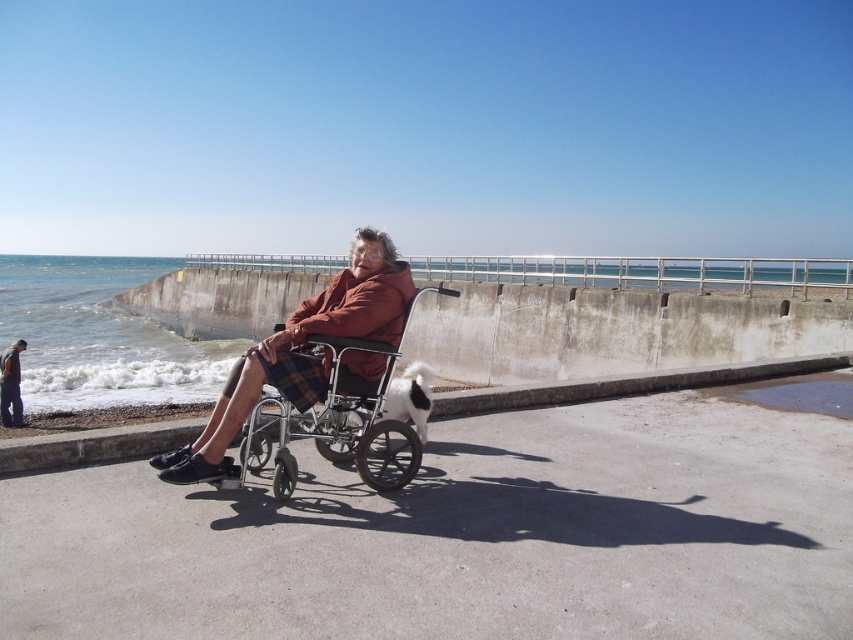
Question: Among these objects, which one is nearest to the camera?

Choices:
 (A) metallic silver wheelchair at center
 (B) concrete at lower center
 (C) dark brown leather jacket at lower left
 (D) white sand at lower left

Answer: (D)

Question: Which point is farther to the camera?

Choices:
 (A) concrete at lower center
 (B) dark brown leather jacket at lower left
 (C) metallic silver wheelchair at center
 (D) white sand at lower left

Answer: (B)

Question: Can you confirm if white sand at lower left is positioned above metallic silver wheelchair at center?

Choices:
 (A) yes
 (B) no

Answer: (B)

Question: Which object is the farthest from the white sand at lower left?

Choices:
 (A) metallic silver wheelchair at center
 (B) concrete at lower center

Answer: (A)

Question: In this image, where is white sand at lower left located relative to concrete at lower center?

Choices:
 (A) left
 (B) right

Answer: (A)

Question: Observing the image, what is the correct spatial positioning of metallic silver wheelchair at center in reference to concrete at lower center?

Choices:
 (A) left
 (B) right

Answer: (A)